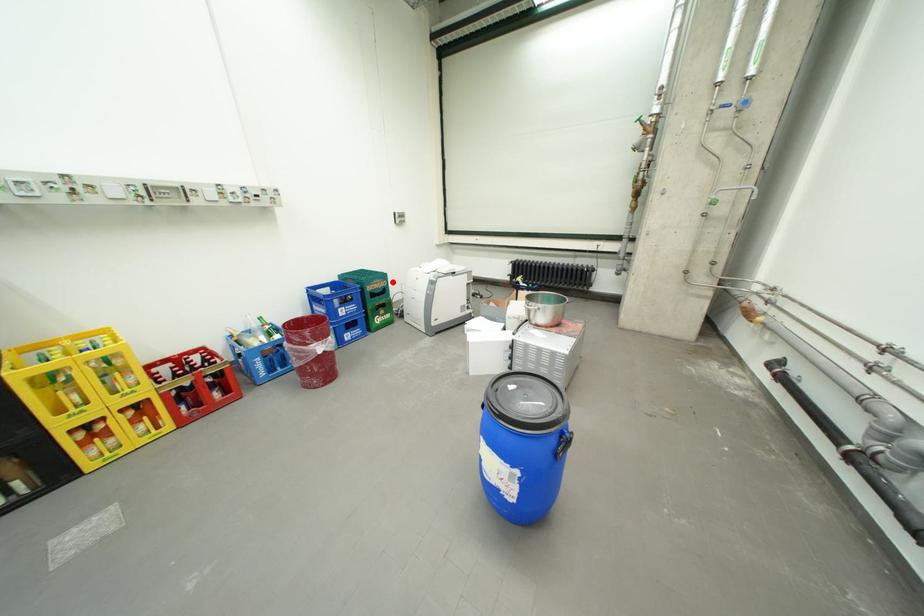
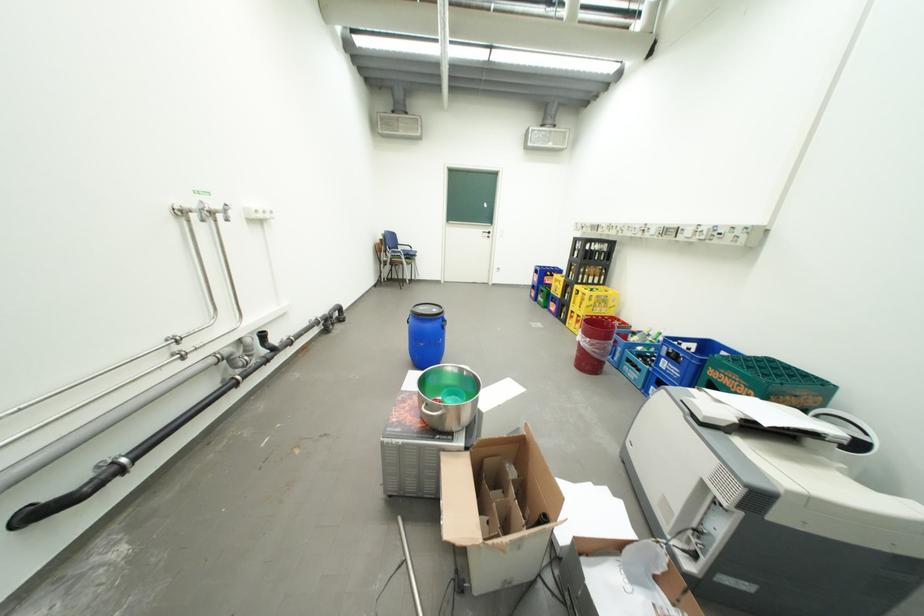
Question: I am providing you with two images of the same scene from different viewpoints. A red point is marked on the first image. Can you still see the location of the red point in image 2?

Choices:
 (A) Yes
 (B) No

Answer: (A)